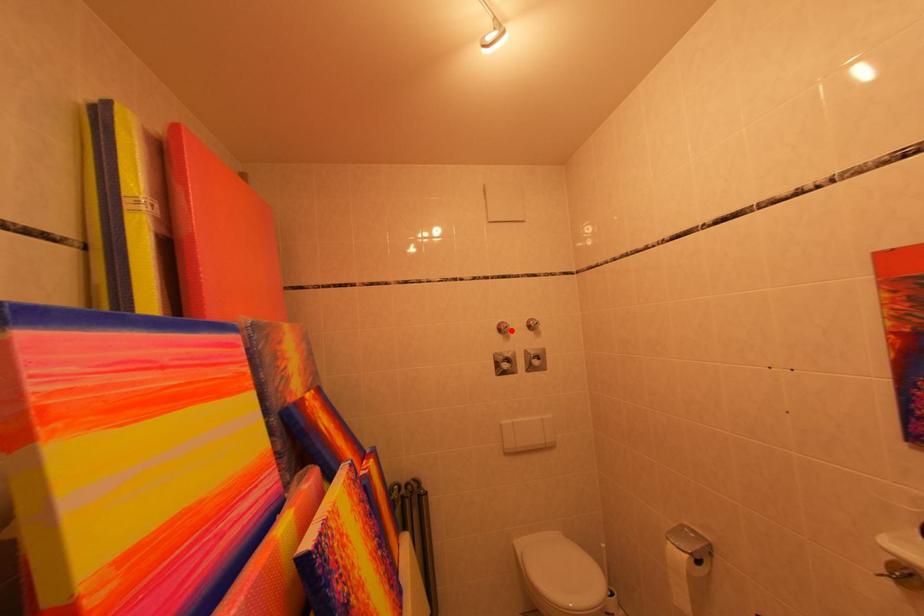
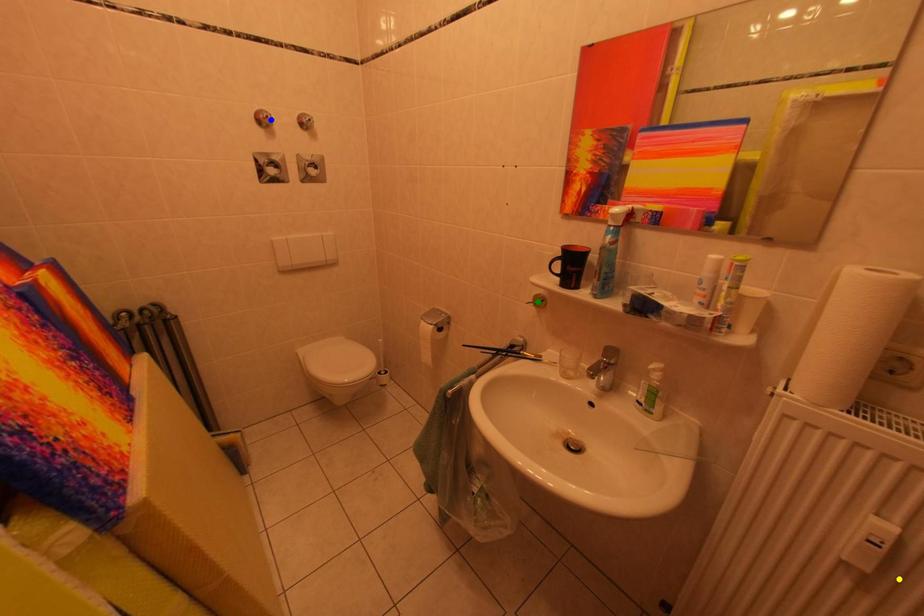
Question: I am providing you with two images of the same scene from different viewpoints. A red point is marked on the first image. You are given multiple points on the second image. In image 2, which mark is for the same physical point as the one in image 1?

Choices:
 (A) blue point
 (B) yellow point
 (C) green point

Answer: (A)